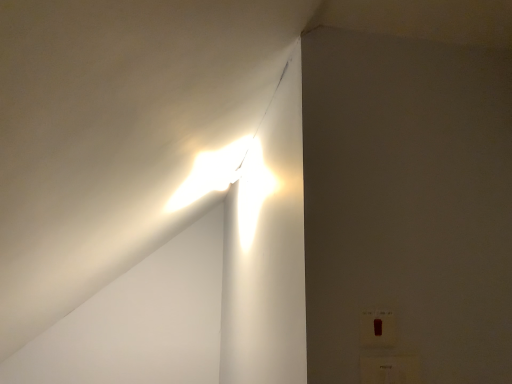
In order to face white plastic electric outlet at lower right, which appears as the 2th electric outlet when viewed from the top, should I rotate leftwards or rightwards?

A 18.046 degree turn to the right will do.

What do you see at coordinates (390, 369) in the screenshot? The height and width of the screenshot is (384, 512). I see `white plastic electric outlet at lower right, which is the first electric outlet from bottom to top` at bounding box center [390, 369].

At what (x,y) coordinates should I click in order to perform the action: click on white plastic electric outlet at lower right, which is the first electric outlet from bottom to top. Please return your answer as a coordinate pair (x, y). The image size is (512, 384). Looking at the image, I should click on (390, 369).

How much space does white plastic electric outlet at lower right, which appears as the 2th electric outlet when viewed from the top, occupy horizontally?

white plastic electric outlet at lower right, which appears as the 2th electric outlet when viewed from the top, is 0.60 inches in width.

This screenshot has height=384, width=512. I want to click on matte white switch at lower right, arranged as the 1th electric outlet when viewed from the top, so click(378, 328).

What do you see at coordinates (378, 328) in the screenshot? The width and height of the screenshot is (512, 384). I see `matte white switch at lower right, arranged as the 1th electric outlet when viewed from the top` at bounding box center [378, 328].

Where is `white plastic electric outlet at lower right, which appears as the 2th electric outlet when viewed from the top`? Image resolution: width=512 pixels, height=384 pixels. white plastic electric outlet at lower right, which appears as the 2th electric outlet when viewed from the top is located at coordinates (390, 369).

In the image, is matte white switch at lower right, placed as the second electric outlet when sorted from bottom to top, on the left side or the right side of white plastic electric outlet at lower right, which appears as the 2th electric outlet when viewed from the top?

matte white switch at lower right, placed as the second electric outlet when sorted from bottom to top, is to the left of white plastic electric outlet at lower right, which appears as the 2th electric outlet when viewed from the top.

Which is behind, matte white switch at lower right, placed as the second electric outlet when sorted from bottom to top, or white plastic electric outlet at lower right, which appears as the 2th electric outlet when viewed from the top?

matte white switch at lower right, placed as the second electric outlet when sorted from bottom to top, is further away from the camera.

Which is behind, point (369, 329) or point (413, 360)?

The point (413, 360) is behind.

From the image's perspective, would you say matte white switch at lower right, placed as the second electric outlet when sorted from bottom to top, is positioned over white plastic electric outlet at lower right, which is the first electric outlet from bottom to top?

Yes, from the image's perspective, matte white switch at lower right, placed as the second electric outlet when sorted from bottom to top, is on top of white plastic electric outlet at lower right, which is the first electric outlet from bottom to top.

From a real-world perspective, which is physically above, matte white switch at lower right, arranged as the 1th electric outlet when viewed from the top, or white plastic electric outlet at lower right, which appears as the 2th electric outlet when viewed from the top?

In real-world perspective, matte white switch at lower right, arranged as the 1th electric outlet when viewed from the top, is above.

Is matte white switch at lower right, arranged as the 1th electric outlet when viewed from the top, wider than white plastic electric outlet at lower right, which appears as the 2th electric outlet when viewed from the top?

No.

Does matte white switch at lower right, placed as the second electric outlet when sorted from bottom to top, have a greater height compared to white plastic electric outlet at lower right, which is the first electric outlet from bottom to top?

Incorrect, the height of matte white switch at lower right, placed as the second electric outlet when sorted from bottom to top, is not larger of that of white plastic electric outlet at lower right, which is the first electric outlet from bottom to top.

Who is bigger, matte white switch at lower right, placed as the second electric outlet when sorted from bottom to top, or white plastic electric outlet at lower right, which is the first electric outlet from bottom to top?

Bigger between the two is white plastic electric outlet at lower right, which is the first electric outlet from bottom to top.

Looking at this image, which is correct: matte white switch at lower right, placed as the second electric outlet when sorted from bottom to top, is inside white plastic electric outlet at lower right, which is the first electric outlet from bottom to top, or outside of it?

matte white switch at lower right, placed as the second electric outlet when sorted from bottom to top, is outside white plastic electric outlet at lower right, which is the first electric outlet from bottom to top.

Is matte white switch at lower right, arranged as the 1th electric outlet when viewed from the top, far from white plastic electric outlet at lower right, which is the first electric outlet from bottom to top?

They are positioned close to each other.

Does matte white switch at lower right, arranged as the 1th electric outlet when viewed from the top, turn towards white plastic electric outlet at lower right, which is the first electric outlet from bottom to top?

No, matte white switch at lower right, arranged as the 1th electric outlet when viewed from the top, is not oriented towards white plastic electric outlet at lower right, which is the first electric outlet from bottom to top.

Locate an element on the screen. electric outlet located on the right of matte white switch at lower right, placed as the second electric outlet when sorted from bottom to top is located at coordinates (390, 369).

Is white plastic electric outlet at lower right, which appears as the 2th electric outlet when viewed from the top, at the left side of matte white switch at lower right, arranged as the 1th electric outlet when viewed from the top?

In fact, white plastic electric outlet at lower right, which appears as the 2th electric outlet when viewed from the top, is to the right of matte white switch at lower right, arranged as the 1th electric outlet when viewed from the top.

Is white plastic electric outlet at lower right, which is the first electric outlet from bottom to top, in front of matte white switch at lower right, placed as the second electric outlet when sorted from bottom to top?

Yes, white plastic electric outlet at lower right, which is the first electric outlet from bottom to top, is closer to the viewer.

Considering the points (375, 370) and (367, 330), which point is in front, point (375, 370) or point (367, 330)?

The point (375, 370) is in front.

From the image's perspective, who appears lower, white plastic electric outlet at lower right, which is the first electric outlet from bottom to top, or matte white switch at lower right, arranged as the 1th electric outlet when viewed from the top?

white plastic electric outlet at lower right, which is the first electric outlet from bottom to top, from the image's perspective.

From a real-world perspective, which object rests below the other?

white plastic electric outlet at lower right, which appears as the 2th electric outlet when viewed from the top, is physically lower.

Can you confirm if white plastic electric outlet at lower right, which is the first electric outlet from bottom to top, is wider than matte white switch at lower right, placed as the second electric outlet when sorted from bottom to top?

Indeed, white plastic electric outlet at lower right, which is the first electric outlet from bottom to top, has a greater width compared to matte white switch at lower right, placed as the second electric outlet when sorted from bottom to top.

Does white plastic electric outlet at lower right, which is the first electric outlet from bottom to top, have a greater height compared to matte white switch at lower right, arranged as the 1th electric outlet when viewed from the top?

Indeed, white plastic electric outlet at lower right, which is the first electric outlet from bottom to top, has a greater height compared to matte white switch at lower right, arranged as the 1th electric outlet when viewed from the top.

Is white plastic electric outlet at lower right, which appears as the 2th electric outlet when viewed from the top, smaller than matte white switch at lower right, placed as the second electric outlet when sorted from bottom to top?

No, white plastic electric outlet at lower right, which appears as the 2th electric outlet when viewed from the top, is not smaller than matte white switch at lower right, placed as the second electric outlet when sorted from bottom to top.

Is matte white switch at lower right, arranged as the 1th electric outlet when viewed from the top, surrounded by white plastic electric outlet at lower right, which appears as the 2th electric outlet when viewed from the top?

No, white plastic electric outlet at lower right, which appears as the 2th electric outlet when viewed from the top, does not contain matte white switch at lower right, arranged as the 1th electric outlet when viewed from the top.

Is there a large distance between white plastic electric outlet at lower right, which is the first electric outlet from bottom to top, and matte white switch at lower right, placed as the second electric outlet when sorted from bottom to top?

Actually, white plastic electric outlet at lower right, which is the first electric outlet from bottom to top, and matte white switch at lower right, placed as the second electric outlet when sorted from bottom to top, are a little close together.

Is white plastic electric outlet at lower right, which is the first electric outlet from bottom to top, facing towards matte white switch at lower right, arranged as the 1th electric outlet when viewed from the top?

No, white plastic electric outlet at lower right, which is the first electric outlet from bottom to top, is not aimed at matte white switch at lower right, arranged as the 1th electric outlet when viewed from the top.

Where is `electric outlet that appears in front of the matte white switch at lower right, placed as the second electric outlet when sorted from bottom to top`? electric outlet that appears in front of the matte white switch at lower right, placed as the second electric outlet when sorted from bottom to top is located at coordinates (390, 369).

This screenshot has width=512, height=384. In order to click on electric outlet below the matte white switch at lower right, placed as the second electric outlet when sorted from bottom to top (from a real-world perspective) in this screenshot , I will do `click(390, 369)`.

You are a GUI agent. You are given a task and a screenshot of the screen. Output one action in this format:
    pyautogui.click(x=<x>, y=<y>)
    Task: Click on the electric outlet that is above the white plastic electric outlet at lower right, which appears as the 2th electric outlet when viewed from the top (from a real-world perspective)
    This screenshot has width=512, height=384.
    Given the screenshot: What is the action you would take?
    pyautogui.click(x=378, y=328)